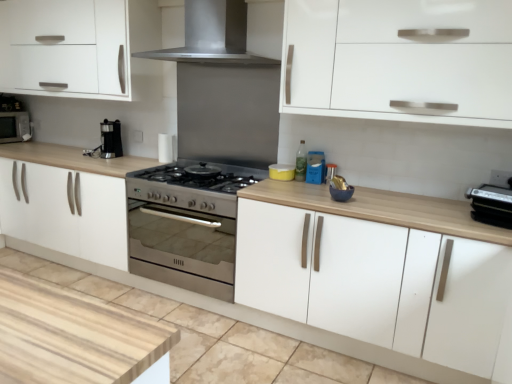
Question: In which direction should I rotate to look at yellow matte container at center, the 3th appliance positioned from the front?

Choices:
 (A) right
 (B) left

Answer: (A)

Question: Considering the relative sizes of metallic silver toaster at center, the 2th appliance positioned from the right, and matte black microwave at left in the image provided, is metallic silver toaster at center, the 2th appliance positioned from the right, smaller than matte black microwave at left?

Choices:
 (A) no
 (B) yes

Answer: (B)

Question: Can you confirm if metallic silver toaster at center, which is the second appliance from left to right, is thinner than matte black microwave at left?

Choices:
 (A) no
 (B) yes

Answer: (B)

Question: Is metallic silver toaster at center, which is the second appliance from left to right, closer to camera compared to matte black microwave at left?

Choices:
 (A) no
 (B) yes

Answer: (B)

Question: Is metallic silver toaster at center, which ranks as the 2th appliance in back-to-front order, not within matte black microwave at left?

Choices:
 (A) yes
 (B) no

Answer: (A)

Question: Is metallic silver toaster at center, which ranks as the 2th appliance in back-to-front order, at the right side of matte black microwave at left?

Choices:
 (A) no
 (B) yes

Answer: (B)

Question: Would you consider metallic silver toaster at center, the 2th appliance positioned from the right, to be distant from matte black microwave at left?

Choices:
 (A) yes
 (B) no

Answer: (A)

Question: Is white matte cabinet at lower center, arranged as the 2th cabinetry when viewed from the right, outside yellow matte container at center, which appears as the third appliance when viewed from the right?

Choices:
 (A) no
 (B) yes

Answer: (B)

Question: Can you confirm if white matte cabinet at lower center, arranged as the 2th cabinetry when viewed from the right, is smaller than yellow matte container at center, which appears as the third appliance when viewed from the right?

Choices:
 (A) no
 (B) yes

Answer: (A)

Question: Is white matte cabinet at lower center, the 1th cabinetry from the left, positioned with its back to yellow matte container at center, which is the 1th appliance from back to front?

Choices:
 (A) no
 (B) yes

Answer: (A)

Question: Does white matte cabinet at lower center, arranged as the 2th cabinetry when viewed from the right, have a greater height compared to yellow matte container at center, marked as the 1th appliance in a left-to-right arrangement?

Choices:
 (A) no
 (B) yes

Answer: (A)

Question: From a real-world perspective, is white matte cabinet at lower center, arranged as the 2th cabinetry when viewed from the right, over yellow matte container at center, marked as the 1th appliance in a left-to-right arrangement?

Choices:
 (A) yes
 (B) no

Answer: (B)

Question: Does white matte cabinet at lower center, arranged as the 2th cabinetry when viewed from the right, have a lesser height compared to yellow matte container at center, which appears as the third appliance when viewed from the right?

Choices:
 (A) yes
 (B) no

Answer: (A)

Question: Does matte black microwave at left appear on the left side of metallic silver toaster at center, which is the second appliance from left to right?

Choices:
 (A) no
 (B) yes

Answer: (B)